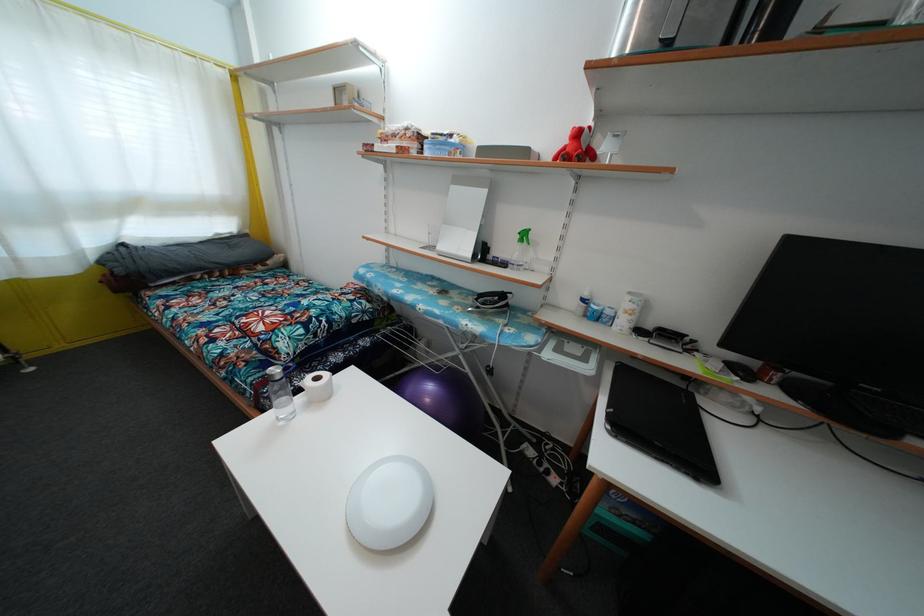
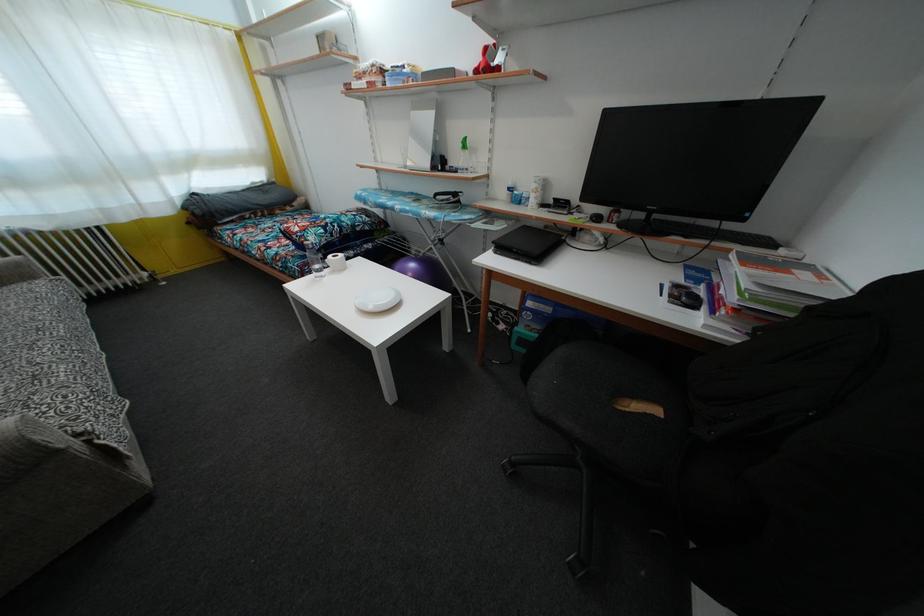
Locate, in the second image, the point that corresponds to (581,140) in the first image.

(490, 58)